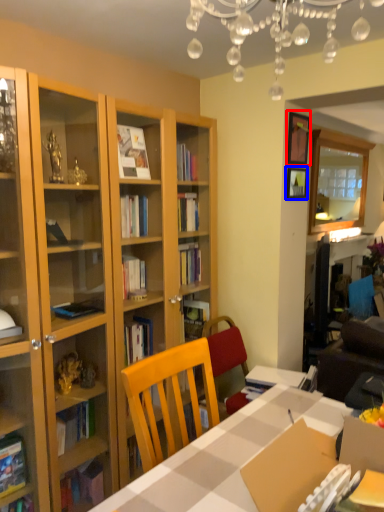
Question: Which object appears farthest to the camera in this image, picture frame (highlighted by a red box) or picture frame (highlighted by a blue box)?

Choices:
 (A) picture frame
 (B) picture frame

Answer: (B)